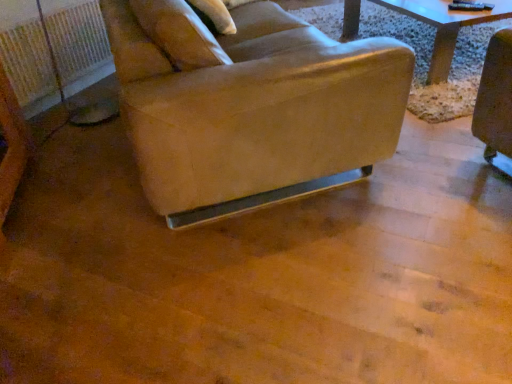
Find the location of a particular element. Image resolution: width=512 pixels, height=384 pixels. beige fabric pillow at upper center is located at coordinates (179, 33).

The width and height of the screenshot is (512, 384). What do you see at coordinates (250, 106) in the screenshot?
I see `leather-like beige chair at center` at bounding box center [250, 106].

The image size is (512, 384). I want to click on beige fabric pillow at upper center, so click(179, 33).

Is point (280, 173) in front of point (179, 41)?

No, it is not.

Looking at this image, which of these two, leather-like beige chair at center or beige fabric pillow at upper center, stands shorter?

With less height is beige fabric pillow at upper center.

Could you tell me if leather-like beige chair at center is facing beige fabric pillow at upper center?

Yes, leather-like beige chair at center is turned towards beige fabric pillow at upper center.

Between leather-like beige chair at center and beige fabric pillow at upper center, which one has smaller size?

Smaller between the two is beige fabric pillow at upper center.

Is leather-like beige chair at center oriented away from white plastic radiator at left?

Yes, leather-like beige chair at center is positioned with its back facing white plastic radiator at left.

Based on their positions, is leather-like beige chair at center located to the left or right of white plastic radiator at left?

leather-like beige chair at center is positioned on white plastic radiator at left's right side.

Is leather-like beige chair at center located outside white plastic radiator at left?

leather-like beige chair at center lies outside white plastic radiator at left's area.

From the image's perspective, which is below, white plastic radiator at left or beige fabric pillow at upper center?

white plastic radiator at left is shown below in the image.

Can you confirm if white plastic radiator at left is taller than beige fabric pillow at upper center?

Yes, white plastic radiator at left is taller than beige fabric pillow at upper center.

Can you tell me how much white plastic radiator at left and beige fabric pillow at upper center differ in facing direction?

The angular difference between white plastic radiator at left and beige fabric pillow at upper center is 44.2 degrees.

In the scene shown: Does white plastic radiator at left turn towards beige fabric pillow at upper center?

No.

Looking at their sizes, would you say beige fabric pillow at upper center is wider or thinner than white plastic radiator at left?

Considering their sizes, beige fabric pillow at upper center looks slimmer than white plastic radiator at left.

Is beige fabric pillow at upper center outside of white plastic radiator at left?

That's correct, beige fabric pillow at upper center is outside of white plastic radiator at left.

Considering the relative positions of beige fabric pillow at upper center and white plastic radiator at left in the image provided, is beige fabric pillow at upper center to the left or to the right of white plastic radiator at left?

Clearly, beige fabric pillow at upper center is on the right of white plastic radiator at left in the image.

Is beige fabric pillow at upper center taller than white plastic radiator at left?

Incorrect, the height of beige fabric pillow at upper center is not larger of that of white plastic radiator at left.

Can you confirm if white plastic radiator at left is wider than leather-like beige chair at center?

Incorrect, the width of white plastic radiator at left does not surpass that of leather-like beige chair at center.

Are white plastic radiator at left and leather-like beige chair at center making contact?

No, white plastic radiator at left is not making contact with leather-like beige chair at center.

From the image's perspective, is white plastic radiator at left on leather-like beige chair at center?

Actually, white plastic radiator at left appears below leather-like beige chair at center in the image.

Is beige fabric pillow at upper center not within leather-like beige chair at center?

No, most part of beige fabric pillow at upper center lies within leather-like beige chair at center.

How many degrees apart are the facing directions of beige fabric pillow at upper center and leather-like beige chair at center?

There is a 1.68-degree angle between the facing directions of beige fabric pillow at upper center and leather-like beige chair at center.

Does beige fabric pillow at upper center turn towards leather-like beige chair at center?

Yes, beige fabric pillow at upper center is turned towards leather-like beige chair at center.

Between beige fabric pillow at upper center and leather-like beige chair at center, which one appears on the right side from the viewer's perspective?

leather-like beige chair at center is more to the right.

The width and height of the screenshot is (512, 384). Identify the location of pillow above the leather-like beige chair at center (from the image's perspective). (179, 33).

Locate an element on the screen. radiator below the leather-like beige chair at center (from the image's perspective) is located at coordinates (25, 51).

Looking at the image, which one is located closer to beige fabric pillow at upper center, white plastic radiator at left or leather-like beige chair at center?

The object closer to beige fabric pillow at upper center is leather-like beige chair at center.

Estimate the real-world distances between objects in this image. Which object is closer to beige fabric pillow at upper center, leather-like beige chair at center or white plastic radiator at left?

leather-like beige chair at center is closer to beige fabric pillow at upper center.

Which object lies nearer to the anchor point white plastic radiator at left, beige fabric pillow at upper center or leather-like beige chair at center?

The object closer to white plastic radiator at left is leather-like beige chair at center.

Considering their positions, is leather-like beige chair at center positioned closer to white plastic radiator at left than beige fabric pillow at upper center?

leather-like beige chair at center is closer to white plastic radiator at left.

In the scene shown: Estimate the real-world distances between objects in this image. Which object is closer to leather-like beige chair at center, beige fabric pillow at upper center or white plastic radiator at left?

beige fabric pillow at upper center lies closer to leather-like beige chair at center than the other object.

From the image, which object appears to be nearer to leather-like beige chair at center, white plastic radiator at left or beige fabric pillow at upper center?

beige fabric pillow at upper center is positioned closer to the anchor leather-like beige chair at center.

Locate an element on the screen. Image resolution: width=512 pixels, height=384 pixels. pillow positioned between leather-like beige chair at center and white plastic radiator at left from near to far is located at coordinates (179, 33).